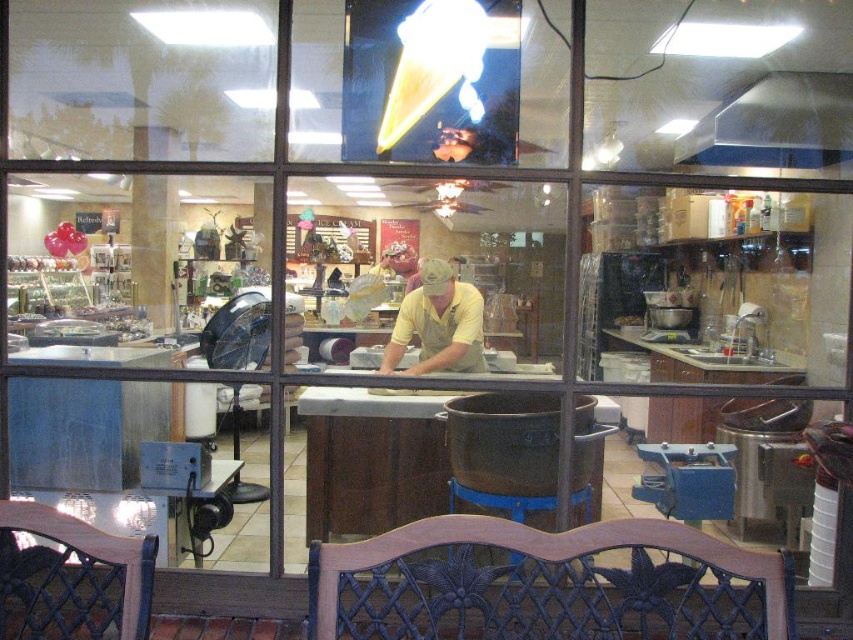
Question: Which object is farther from the camera taking this photo?

Choices:
 (A) wooden stool at center
 (B) wooden chair at lower left
 (C) yellow matte shirt at center

Answer: (C)

Question: Is wooden chair with dark finish at lower center positioned at the back of wooden chair at lower left?

Choices:
 (A) yes
 (B) no

Answer: (A)

Question: Does wooden chair at lower left appear on the left side of wooden stool at center?

Choices:
 (A) yes
 (B) no

Answer: (A)

Question: Among these objects, which one is farthest from the camera?

Choices:
 (A) wooden stool at center
 (B) wooden chair at lower left
 (C) wooden chair with dark finish at lower center

Answer: (A)

Question: Is wooden chair at lower left smaller than wooden stool at center?

Choices:
 (A) yes
 (B) no

Answer: (A)

Question: Which point is farther to the camera?

Choices:
 (A) (512, 500)
 (B) (434, 285)
 (C) (45, 627)

Answer: (B)